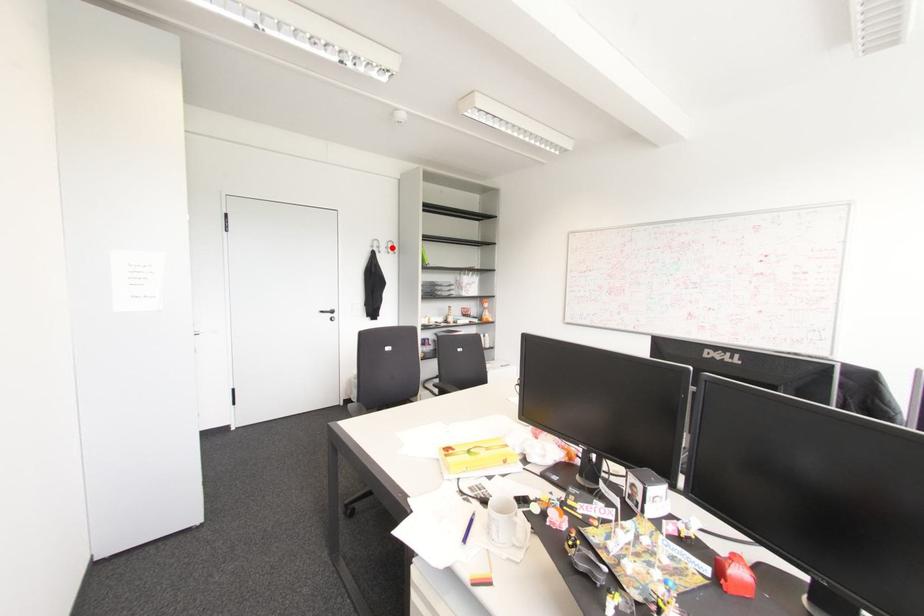
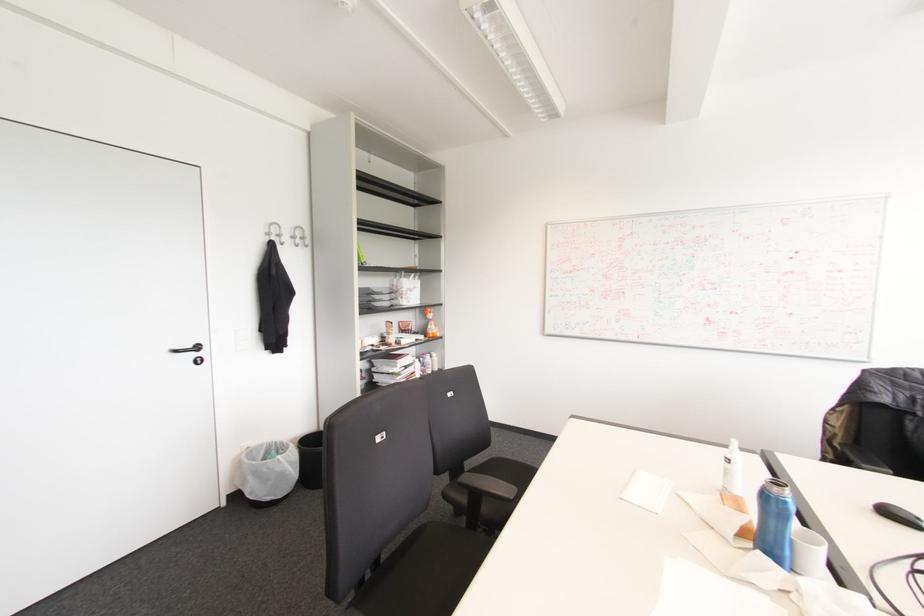
In the second image, find the point that corresponds to the highlighted location in the first image.

(301, 238)